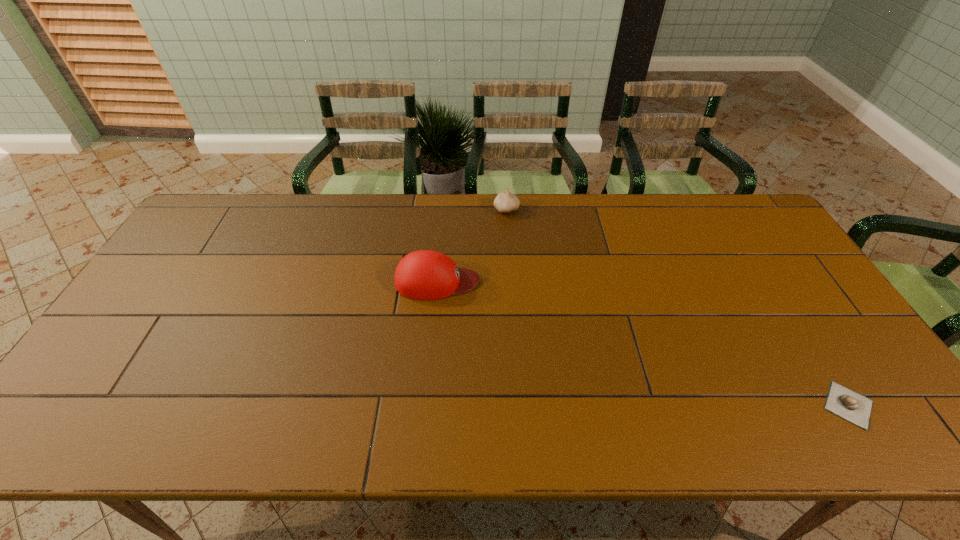
Where is `object that is at the near edge`? Image resolution: width=960 pixels, height=540 pixels. object that is at the near edge is located at coordinates (841, 401).

Where is `object located in the right edge section of the desktop`? object located in the right edge section of the desktop is located at coordinates (841, 401).

Locate an element on the screen. object present at the near right corner is located at coordinates (841, 401).

I want to click on vacant area at the far edge, so click(569, 196).

Identify the location of free space at the near edge. This screenshot has width=960, height=540. (729, 424).

This screenshot has width=960, height=540. Identify the location of vacant space at the left edge of the desktop. (97, 367).

In the image, there is a desktop. In order to click on vacant space at the right edge in this screenshot , I will do click(781, 280).

Find the location of a particular element. vacant region at the near left corner is located at coordinates (x=132, y=412).

This screenshot has width=960, height=540. Find the location of `free space at the far right corner of the desktop`. free space at the far right corner of the desktop is located at coordinates (746, 223).

Locate an element on the screen. vacant point located between the second shortest object and the nearer garlic is located at coordinates (678, 307).